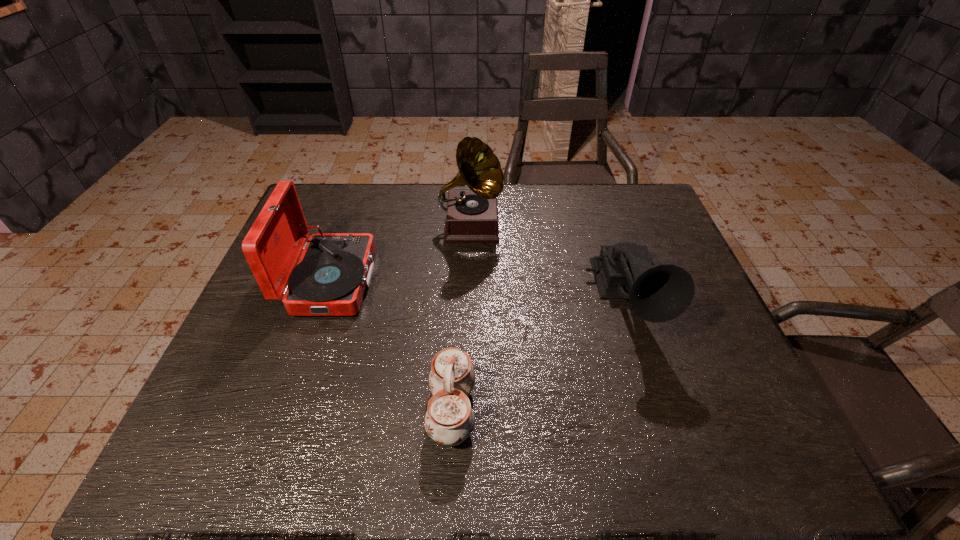
Where is `object that is at the far edge`? This screenshot has height=540, width=960. object that is at the far edge is located at coordinates (x=471, y=216).

Where is `object that is at the near edge`? object that is at the near edge is located at coordinates click(449, 420).

This screenshot has width=960, height=540. I want to click on object located at the left edge, so click(334, 269).

Image resolution: width=960 pixels, height=540 pixels. I want to click on object present at the right edge, so click(660, 293).

The width and height of the screenshot is (960, 540). I want to click on vacant space at the far edge of the desktop, so click(553, 190).

Identify the location of vacant space at the near edge of the desktop. (267, 465).

Identify the location of free region at the left edge of the desktop. This screenshot has height=540, width=960. (251, 387).

Find the location of `free spot at the right edge of the desktop`. free spot at the right edge of the desktop is located at coordinates (714, 397).

At what (x,y) coordinates should I click in order to perform the action: click on vacant space at the far left corner of the desktop. Please return your answer as a coordinate pair (x, y). This screenshot has width=960, height=540. Looking at the image, I should click on (327, 212).

At what (x,y) coordinates should I click in order to perform the action: click on free region at the near left corner of the desktop. Please return your answer as a coordinate pair (x, y). Looking at the image, I should click on (208, 451).